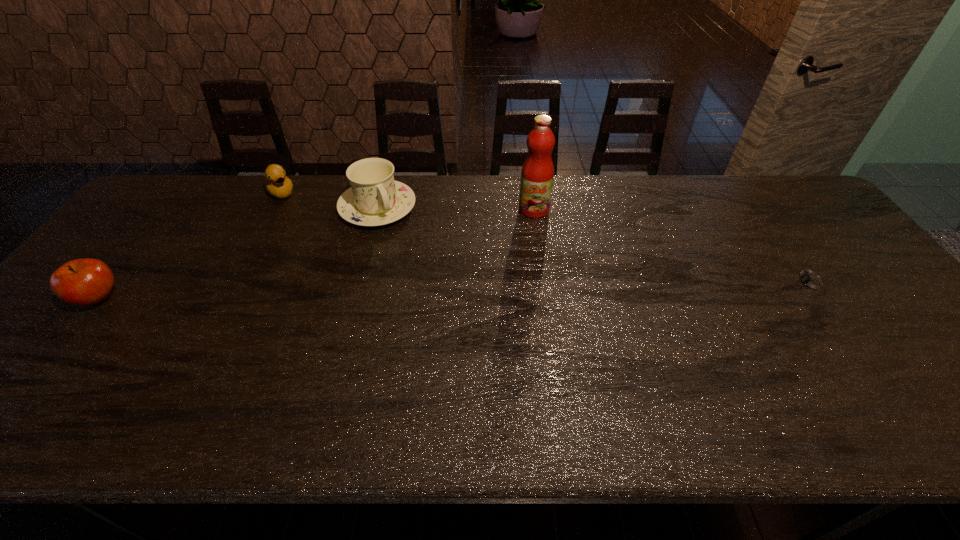
Select which object appears as the second closest to the third object from right to left. Please provide its 2D coordinates. Your answer should be formatted as a tuple, i.e. [(x, y)], where the tuple contains the x and y coordinates of a point satisfying the conditions above.

[(537, 174)]

You are a GUI agent. You are given a task and a screenshot of the screen. Output one action in this format:
    pyautogui.click(x=<x>, y=<y>)
    Task: Click on the vacant region that satisfies the following two spatial constraints: 1. on the back side of the leftmost object; 2. on the face of the watch
    The image size is (960, 540).
    Given the screenshot: What is the action you would take?
    pyautogui.click(x=111, y=283)

This screenshot has width=960, height=540. Identify the location of vacant point that satisfies the following two spatial constraints: 1. on the back side of the apple; 2. on the face of the watch. (111, 283).